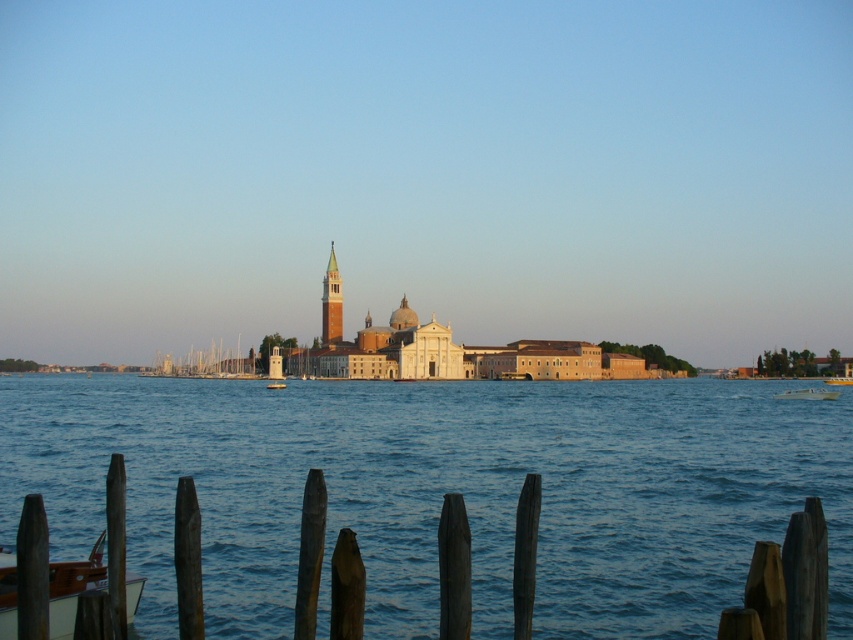
You are a photographer positioned at the wooden fence in the foreground of the waterfront scene. You want to capture a photo of the white glossy boat at center without including the historic buildings in the background. Is the boat positioned in a way that allows you to frame it without the buildings obstructing the shot?

The white glossy boat at center is located at point (808, 394), which is near the lower part of the image. Since the historic buildings are in the midground, the boat can be framed below them, avoiding obstruction. Yes, you can capture the boat without the buildings obstructing the shot.

You are standing at the wooden posts at lower center and want to reach the yellow plastic boat at center. Which direction should you move to get there?

You should move upward to reach the yellow plastic boat at center since the wooden posts at lower center are positioned under it.